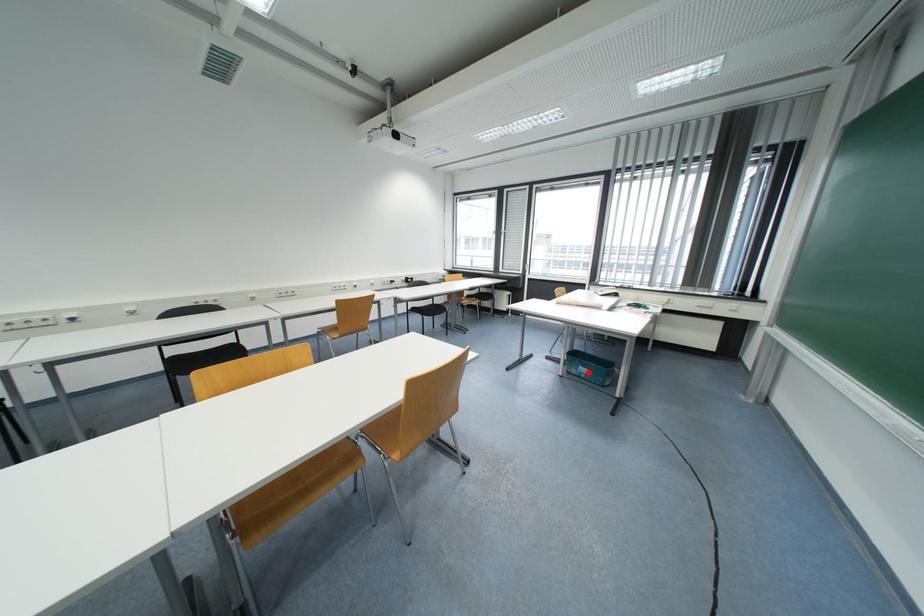
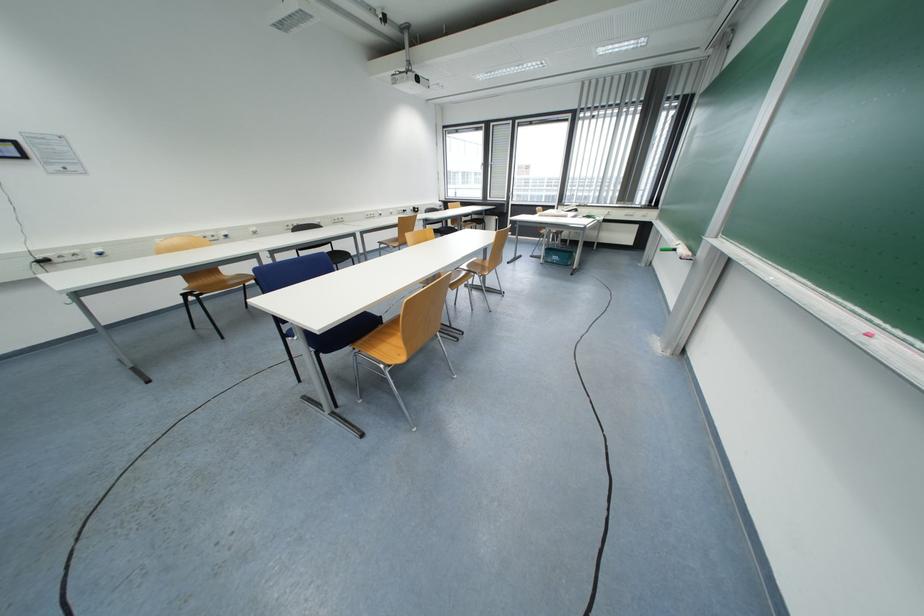
Where in the second image is the point corresponding to the highlighted location from the first image?

(561, 260)